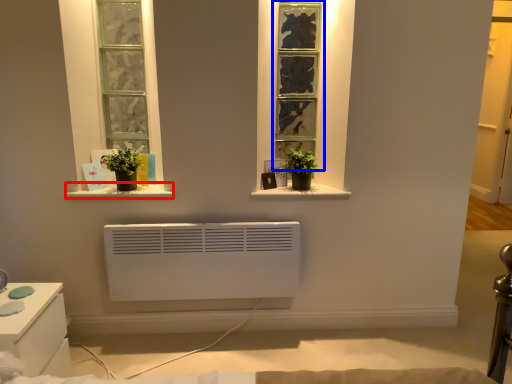
Question: Among these objects, which one is farthest to the camera, window sill (highlighted by a red box) or window (highlighted by a blue box)?

Choices:
 (A) window sill
 (B) window

Answer: (B)